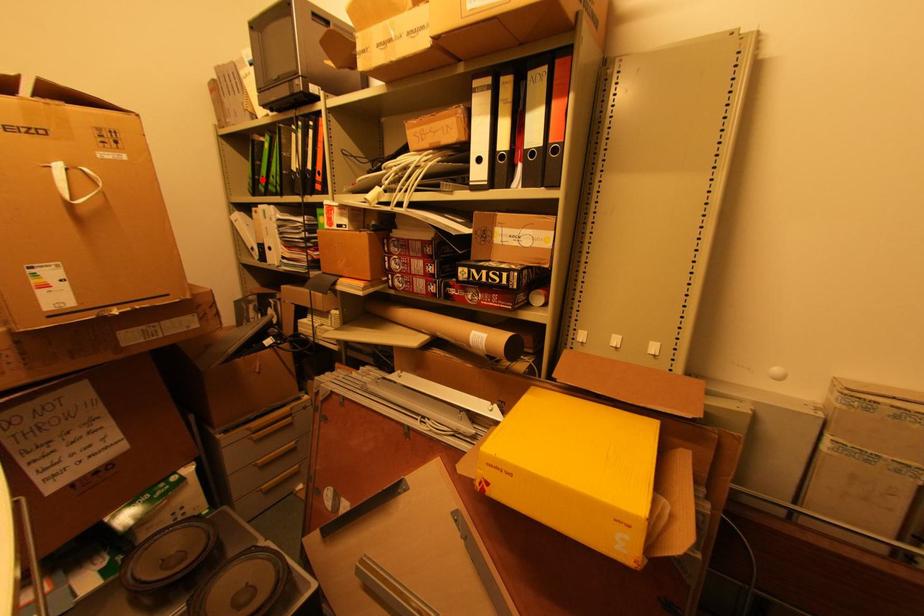
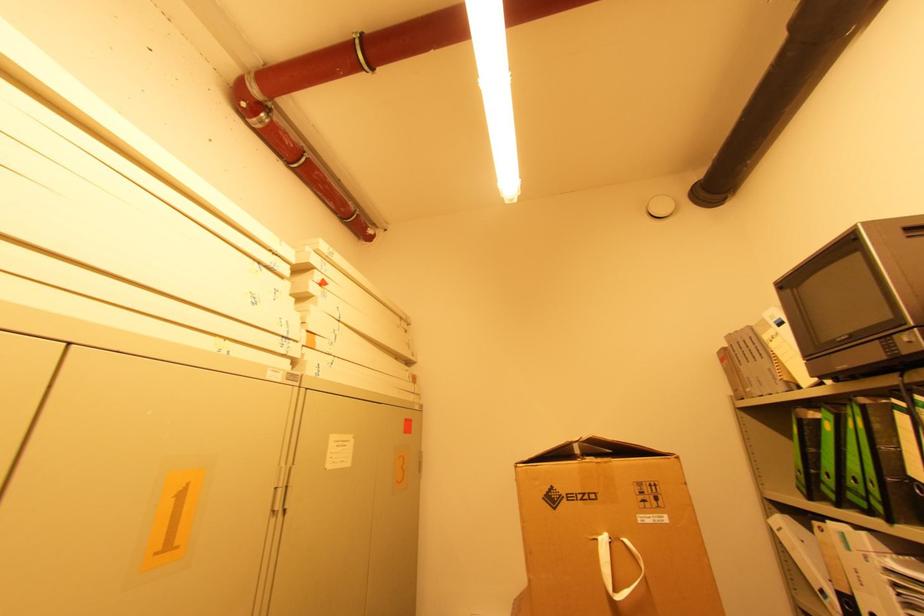
Locate, in the second image, the point that corresponds to the highlighted location in the first image.

(822, 476)